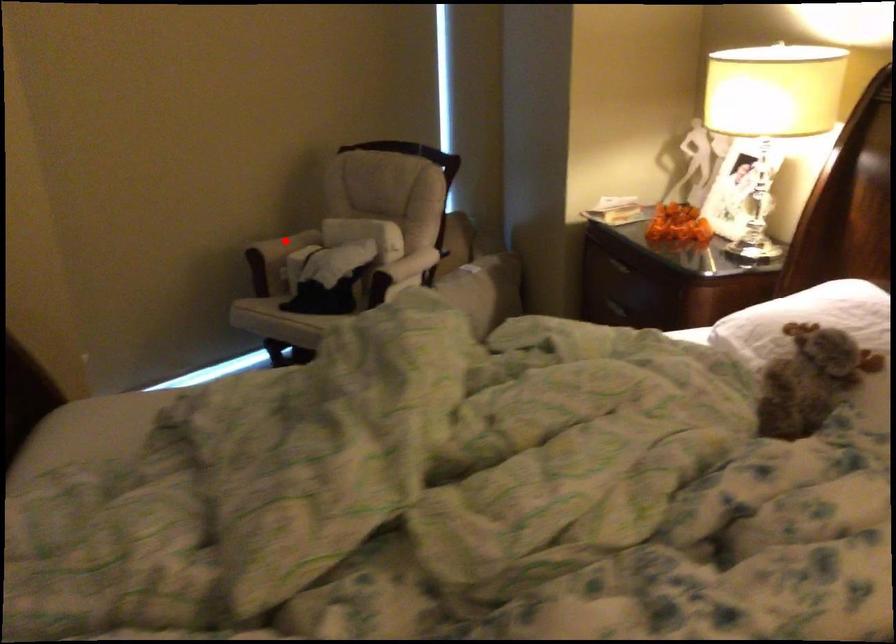
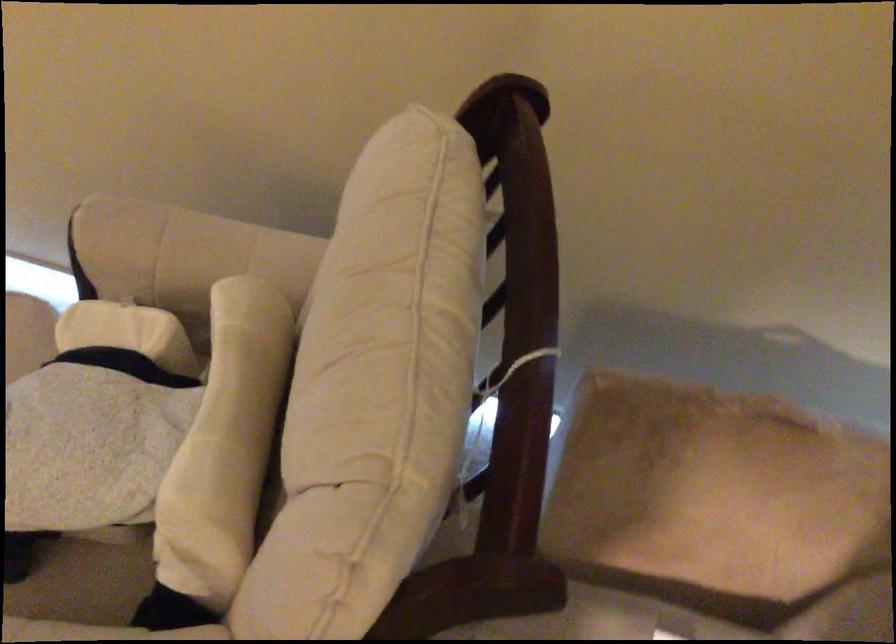
Question: A red point is marked in image1. In image2, is the corresponding 3D point closer to the camera or farther? Reply with the corresponding letter.

Choices:
 (A) The corresponding 3D point is closer.
 (B) The corresponding 3D point is farther.

Answer: (A)